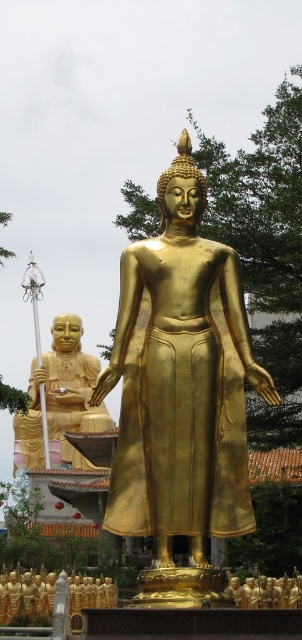
You are standing in front of the two Buddha statues and want to place a small offering at the closest point between point (206,522) and point (18,429). Which point should you walk towards to place the offering?

You should walk towards point (206,522) because it is closer to the viewer than point (18,429).

You are standing in front of the two golden Buddha statues. There is a specific point at coordinates point (48, 371) that you want to reach. Considering the distance from your current position, can you estimate whether this point is relatively close or far away?

The point (48, 371) is 185.96 meters away from the viewer, so it is relatively far away.

You are a visitor at a temple and want to take a photo of the gold polished statue at center and gold metallic statue at lower center. Which one should you focus on first if you want to capture both in the same frame without moving your camera?

You should focus on the gold polished statue at center first because it is in front of the gold metallic statue at lower center, so keeping it in focus will ensure both are visible in the frame.